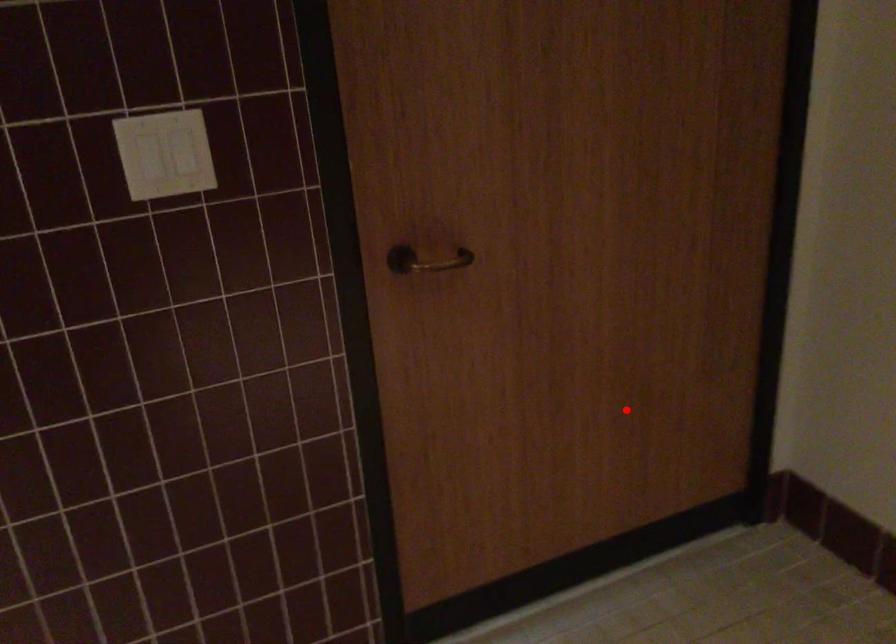
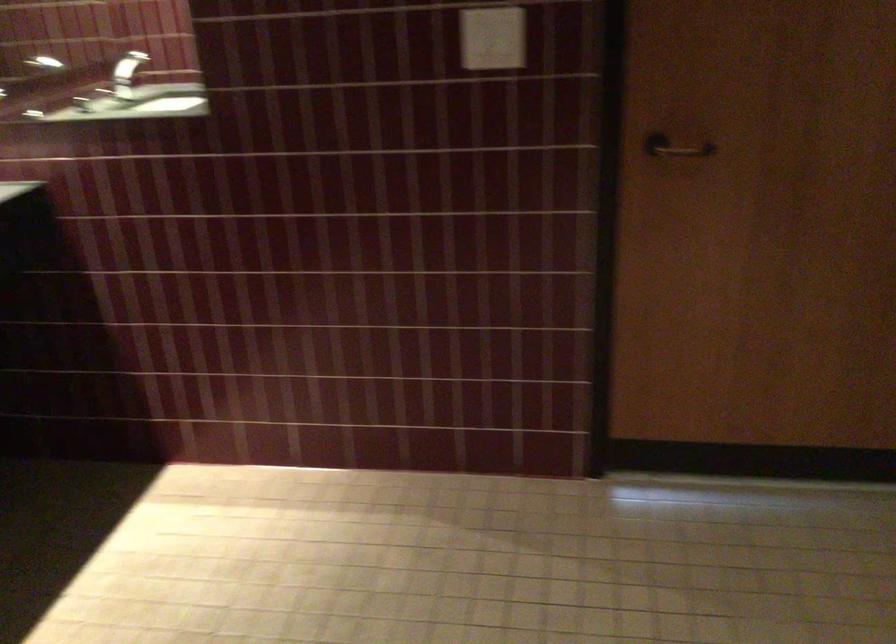
Locate, in the second image, the point that corresponds to the highlighted location in the first image.

(857, 321)